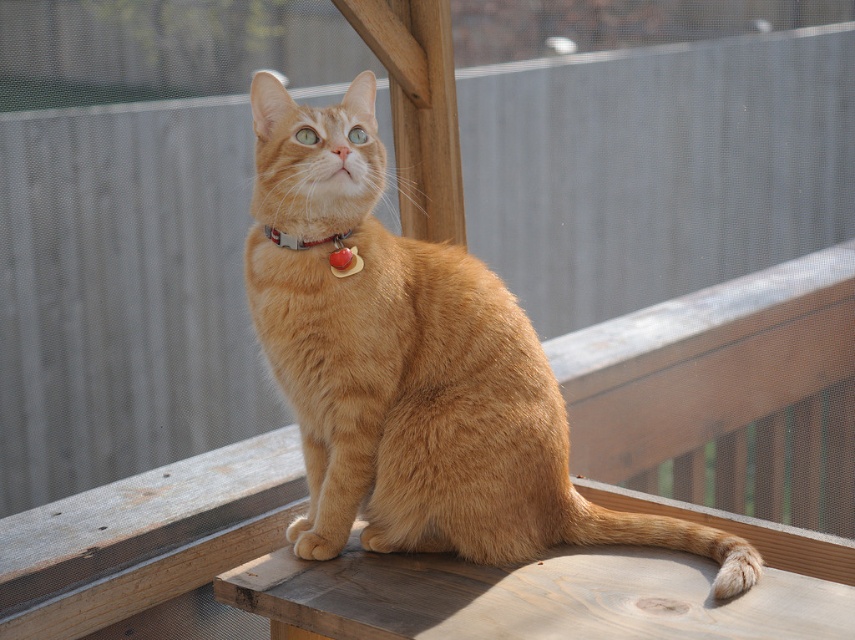
Question: Among these objects, which one is nearest to the camera?

Choices:
 (A) matte plastic collar at center
 (B) metallic silver collar at center
 (C) orange fur cat at center

Answer: (C)

Question: Estimate the real-world distances between objects in this image. Which object is farther from the orange fur cat at center?

Choices:
 (A) metallic silver collar at center
 (B) matte plastic collar at center

Answer: (A)

Question: Does matte plastic collar at center have a larger size compared to metallic silver collar at center?

Choices:
 (A) no
 (B) yes

Answer: (B)

Question: Is the position of matte plastic collar at center more distant than that of metallic silver collar at center?

Choices:
 (A) no
 (B) yes

Answer: (B)

Question: Where is orange fur cat at center located in relation to matte plastic collar at center in the image?

Choices:
 (A) above
 (B) below

Answer: (B)

Question: Which is nearer to the matte plastic collar at center?

Choices:
 (A) orange fur cat at center
 (B) metallic silver collar at center

Answer: (B)